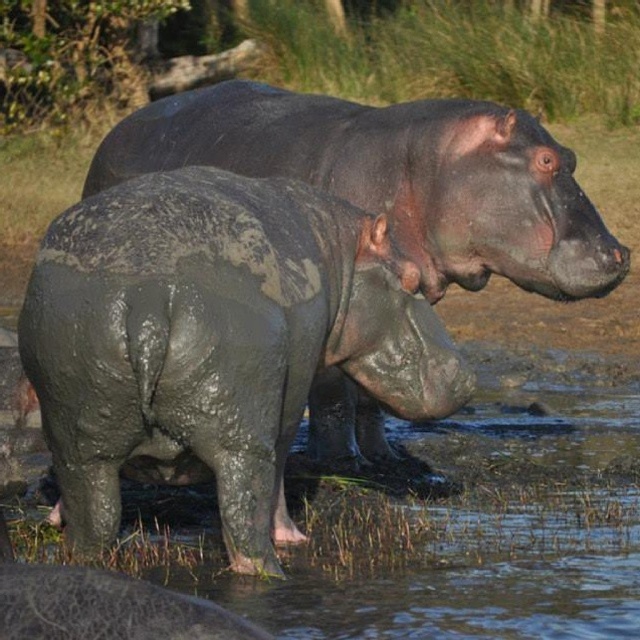
You are observing two points in the image of the hippos. Which point, point (x=268, y=474) or point (x=225, y=579), is closer to you?

Point (x=268, y=474) is closer to the viewer than point (x=225, y=579).

You are standing at the point marked by coordinates point, which is [24,301]. You want to observe the two hippos in the image. How far apart are the two hippos from each other?

The two hippos are 14.64 feet apart.